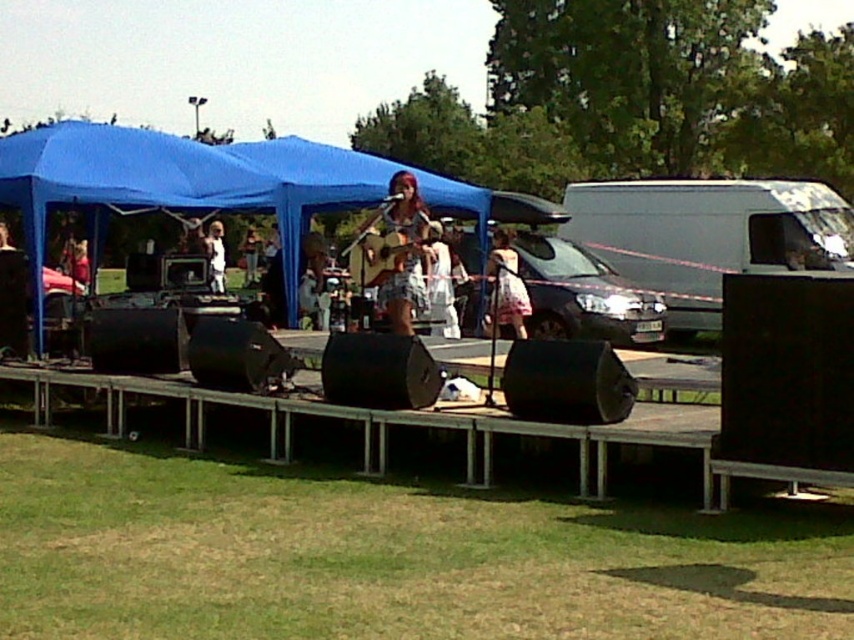
Does blue fabric tent at center appear over white matte van at right?

Indeed, blue fabric tent at center is positioned over white matte van at right.

Image resolution: width=854 pixels, height=640 pixels. I want to click on blue fabric tent at center, so click(202, 180).

Which is in front, point (449, 291) or point (209, 266)?

Point (449, 291)

Which is below, white cotton dress at center or white fabric dress at center?

white cotton dress at center is lower down.

Does point (427, 308) come closer to viewer compared to point (215, 224)?

Yes, it is in front of point (215, 224).

Where is `white cotton dress at center`? white cotton dress at center is located at coordinates (440, 284).

Between blue fabric tent at center and white fabric dress at center, which one is positioned lower?

white fabric dress at center is lower down.

Consider the image. How distant is blue fabric tent at center from white fabric dress at center?

8.06 feet

Is point (32, 202) closer to viewer compared to point (218, 256)?

That is True.

Find the location of `blue fabric tent at center`. blue fabric tent at center is located at coordinates (202, 180).